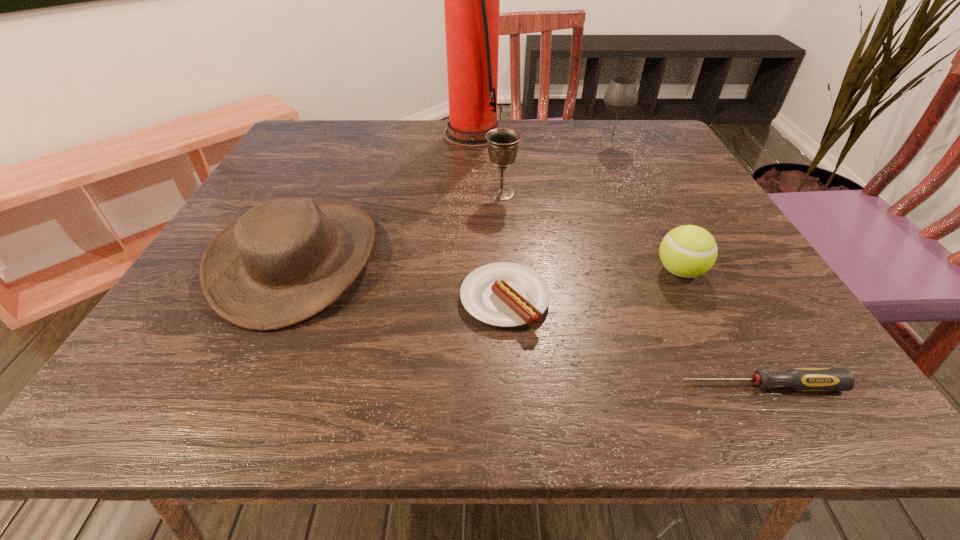
This screenshot has width=960, height=540. In order to click on the tallest object in this screenshot , I will do `click(471, 0)`.

Find the location of a particular element. the sixth shortest object is located at coordinates (621, 95).

Identify the location of the fifth nearest object. This screenshot has height=540, width=960. (502, 143).

Image resolution: width=960 pixels, height=540 pixels. Identify the location of chalice. (502, 143).

You are a GUI agent. You are given a task and a screenshot of the screen. Output one action in this format:
    pyautogui.click(x=<x>, y=<y>)
    Task: Click on the cowboy hat
    Image resolution: width=960 pixels, height=540 pixels.
    Given the screenshot: What is the action you would take?
    pyautogui.click(x=284, y=261)

This screenshot has height=540, width=960. I want to click on tennis ball, so click(687, 251).

Image resolution: width=960 pixels, height=540 pixels. Find the location of `the sixth tallest object`. the sixth tallest object is located at coordinates (503, 294).

Where is `the shortest object`? the shortest object is located at coordinates (800, 379).

Identify the location of the nearest object. This screenshot has width=960, height=540. (800, 379).

This screenshot has height=540, width=960. I want to click on vacant area located 0.140m at the discharge end of the tallest object, so click(x=557, y=135).